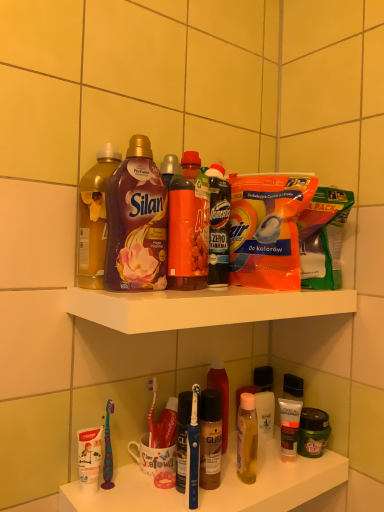
Image resolution: width=384 pixels, height=512 pixels. Identify the location of vacant space positioned to the left of blue plastic toothbrush at lower center. (132, 496).